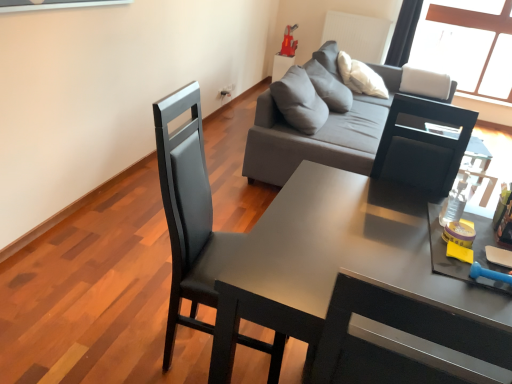
Question: Looking at the image, does matte black desk at center seem bigger or smaller compared to gray fabric couch at upper center?

Choices:
 (A) big
 (B) small

Answer: (B)

Question: From the image's perspective, is matte black desk at center located above or below gray fabric couch at upper center?

Choices:
 (A) above
 (B) below

Answer: (B)

Question: Estimate the real-world distances between objects in this image. Which object is farther from the gray fabric side table at upper center?

Choices:
 (A) matte black desk at center
 (B) matte black chair at center-left
 (C) rubberized red toy at upper center
 (D) gray fabric couch at upper center

Answer: (A)

Question: Which is nearer to the matte black chair at center-left?

Choices:
 (A) matte black desk at center
 (B) gray fabric couch at upper center
 (C) gray fabric side table at upper center
 (D) rubberized red toy at upper center

Answer: (A)